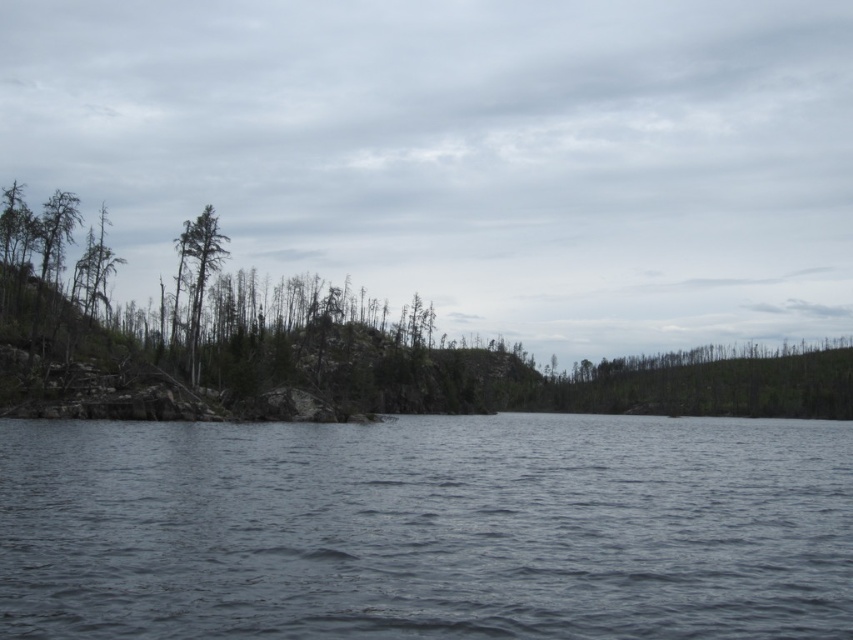
Who is positioned more to the left, green matte trees at left or green matte tree at upper left?

green matte tree at upper left is more to the left.

Is green matte trees at left smaller than green matte tree at upper left?

Incorrect, green matte trees at left is not smaller in size than green matte tree at upper left.

What do you see at coordinates (345, 340) in the screenshot? This screenshot has width=853, height=640. I see `green matte trees at left` at bounding box center [345, 340].

Identify the location of green matte trees at left. The width and height of the screenshot is (853, 640). tap(345, 340).

Which of these two, dark blue water at center or green matte trees at left, stands shorter?

With less height is dark blue water at center.

Between dark blue water at center and green matte trees at left, which one is positioned higher?

green matte trees at left

The width and height of the screenshot is (853, 640). I want to click on dark blue water at center, so pyautogui.click(x=427, y=529).

Which is more to the right, dark blue water at center or green matte tree at upper left?

dark blue water at center

Is dark blue water at center to the right of green matte tree at upper left from the viewer's perspective?

Indeed, dark blue water at center is positioned on the right side of green matte tree at upper left.

Does point (717, 602) come farther from viewer compared to point (194, 252)?

No, (717, 602) is in front of (194, 252).

In order to click on dark blue water at center in this screenshot , I will do `click(427, 529)`.